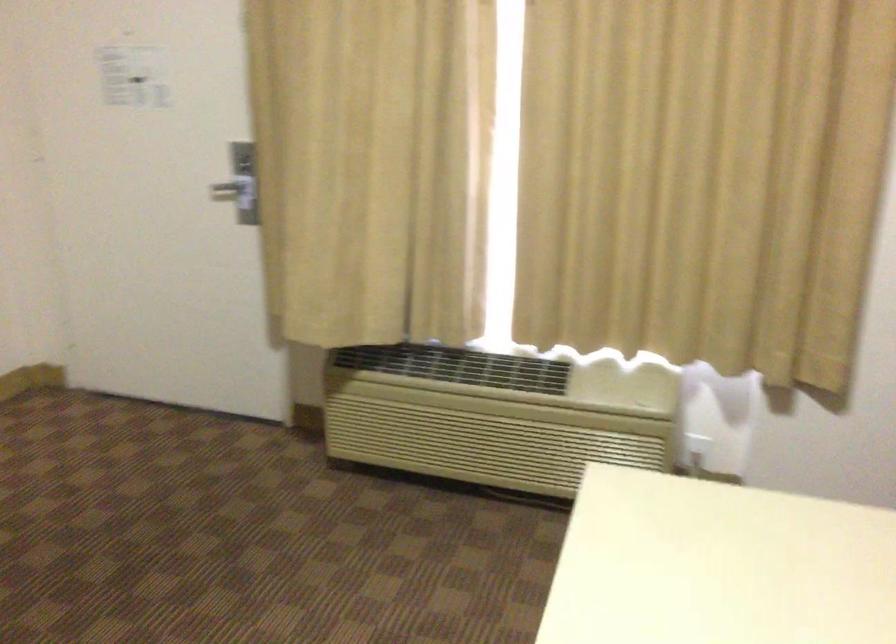
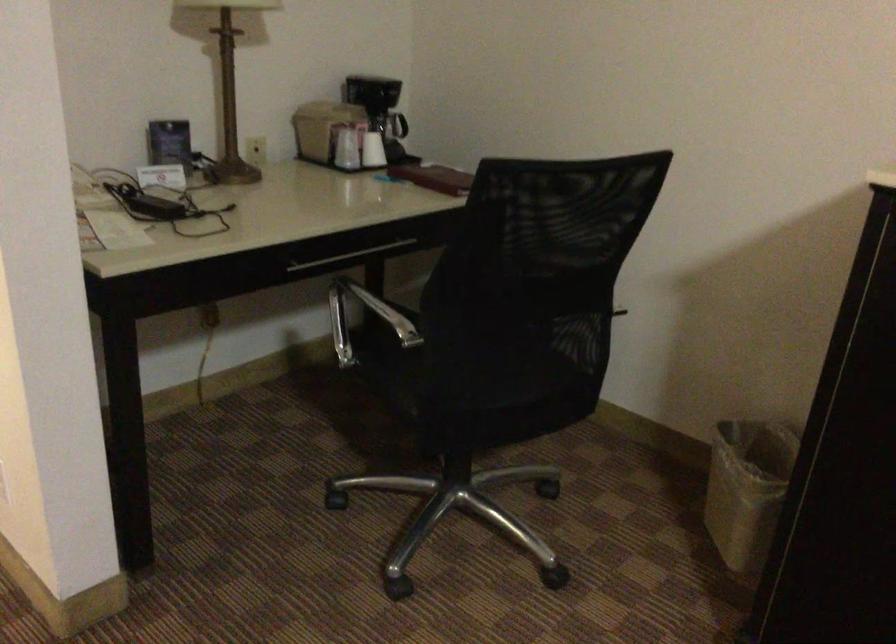
The first image is from the beginning of the video and the second image is from the end. How did the camera likely rotate when shooting the video?

The rotation direction of the camera is left-down.